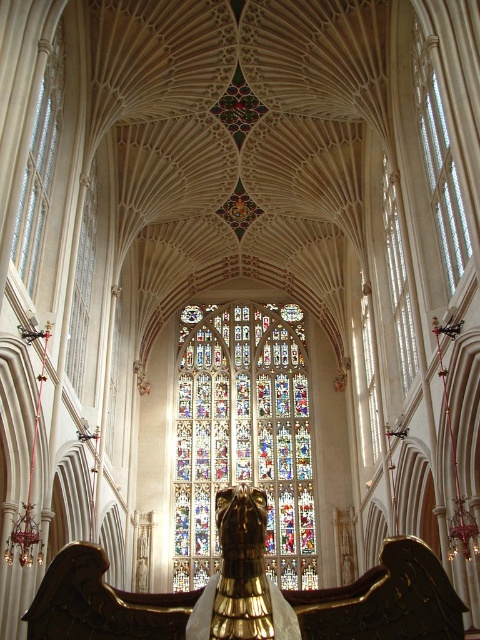
You are standing inside the grand cathedral and want to take a photo of the point at coordinate (80, 241). If your camera has a maximum range of 300 feet, will you be able to capture the point in your photo?

The point at coordinate (80, 241) is 293.39 feet away from the camera, which is within the camera maximum range of 300 feet. So yes, you can capture the point in your photo.

You are an architect visiting the cathedral and want to install a new decorative element between the stained glass window at center and the transparent stained glass at center. Which one is bigger to help you decide placement?

The stained glass window at center has a larger size compared to transparent stained glass at center, so you should place the decorative element near the stained glass window at center to ensure proper proportion and balance.

You are an interior designer planning to install a new lighting fixture in the cathedral. You have two options for placement based on the stained glass window at center and the transparent stained glass at center. Which of these two objects has a wider span to accommodate a larger fixture?

The stained glass window at center has a larger width than the transparent stained glass at center, making it the better option for accommodating a larger lighting fixture.